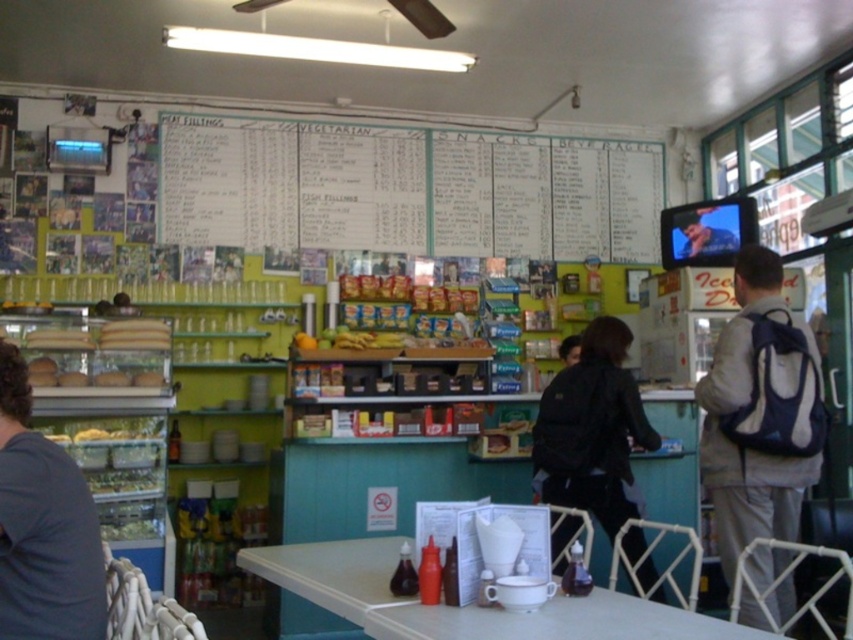
You are a customer at the deli counter and want to place an order. You notice the white paperboard at upper center and the black backpack at center. Which item has a greater width?

The white paperboard at upper center has a greater width than the black backpack at center.

You are a customer at this deli and need to place your backpacks on the counter. The gray fabric backpack at right is smaller than the black backpack at center. Which backpack should you choose to leave on the counter if you want to occupy less space?

The gray fabric backpack at right is smaller than the black backpack at center, so it occupies less space. You should leave the gray fabric backpack at right on the counter.

You are a customer standing at the entrance of the deli and want to grab both items located at point [726,344] and point [434,625]. Which item should you pick up first to minimize walking back and forth?

You should pick up the item at point [726,344] first because it is closer to you than the other point, so you can grab it without needing to walk further away first.